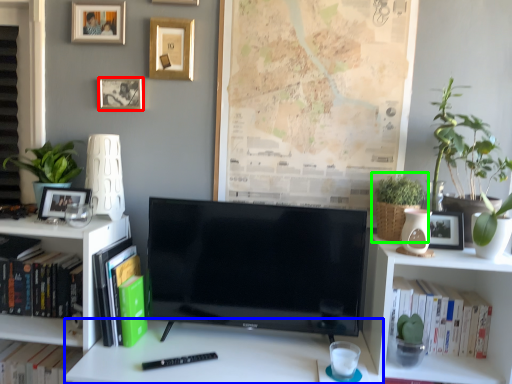
Question: Which object is positioned farthest from picture frame (highlighted by a red box)? Select from desk (highlighted by a blue box) and houseplant (highlighted by a green box).

Choices:
 (A) desk
 (B) houseplant

Answer: (B)